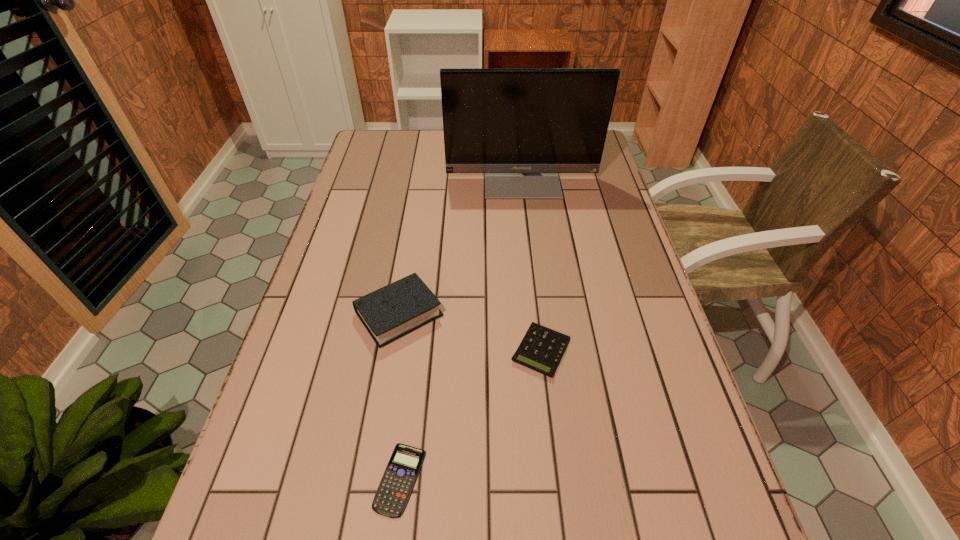
Locate an element on the screen. the farthest object is located at coordinates (521, 127).

Locate an element on the screen. This screenshot has height=540, width=960. computer monitor is located at coordinates (521, 127).

Image resolution: width=960 pixels, height=540 pixels. I want to click on Bible, so click(x=397, y=309).

At what (x,y) coordinates should I click in order to perform the action: click on the taller calculator. Please return your answer as a coordinate pair (x, y). This screenshot has width=960, height=540. Looking at the image, I should click on click(541, 349).

The height and width of the screenshot is (540, 960). What are the coordinates of `the farther calculator` in the screenshot? It's located at (541, 349).

At what (x,y) coordinates should I click in order to perform the action: click on the nearer calculator. Please return your answer as a coordinate pair (x, y). The height and width of the screenshot is (540, 960). Looking at the image, I should click on (395, 488).

I want to click on the shorter calculator, so click(x=395, y=488).

Find the location of a particular element. vacant space situated 0.050m on the screen of the computer monitor is located at coordinates (525, 209).

Identify the location of blank space located 0.170m on the front of the second tallest object. This screenshot has width=960, height=540. (382, 418).

This screenshot has height=540, width=960. I want to click on vacant point located on the right of the second shortest object, so click(641, 350).